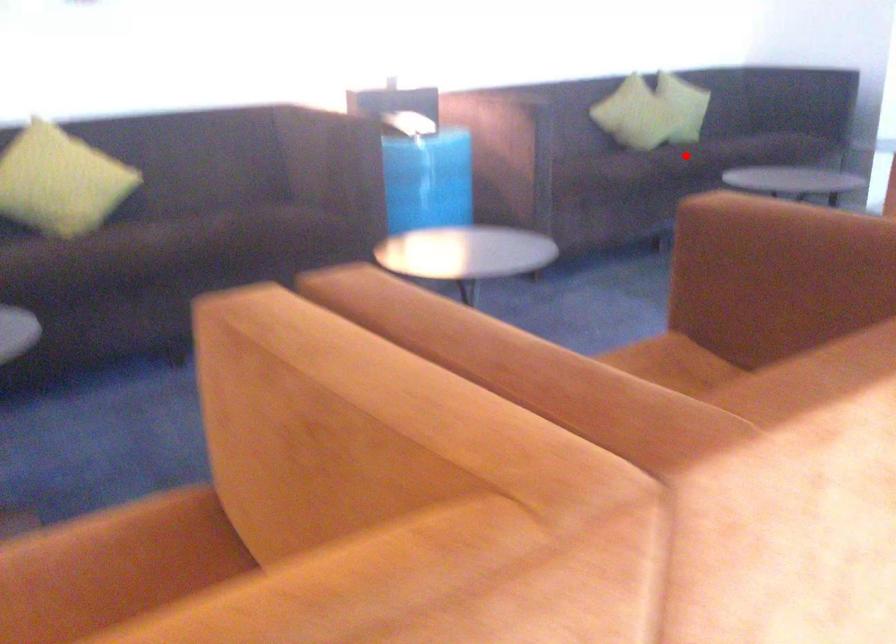
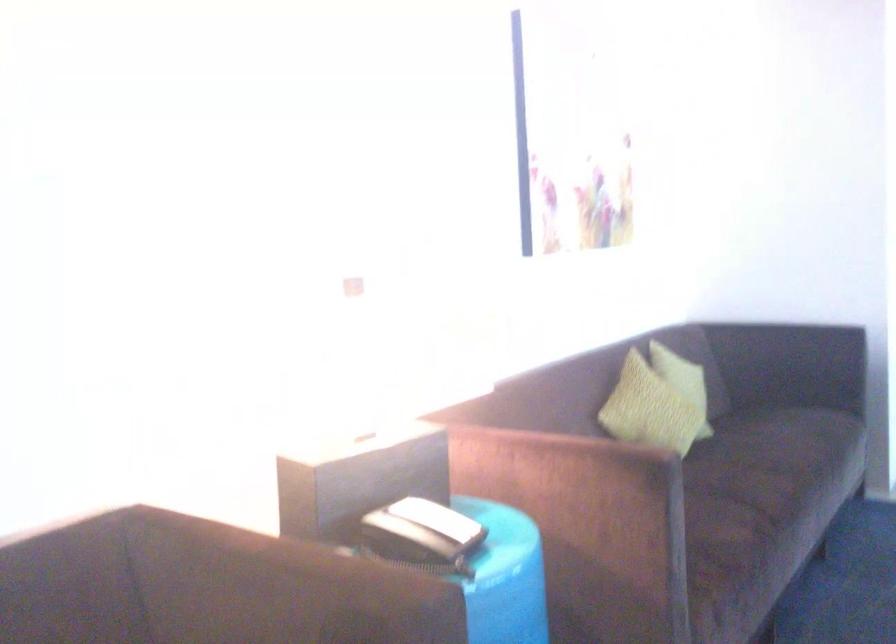
Where in the second image is the point corresponding to the highlighted location from the first image?

(768, 489)